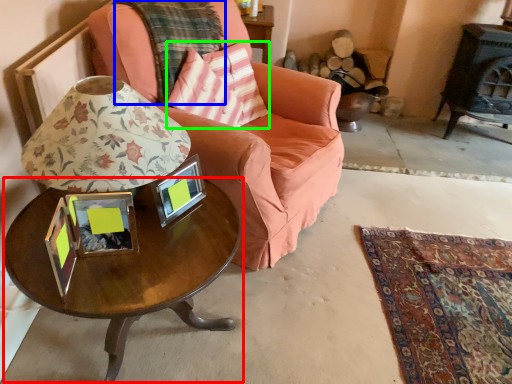
Question: Which object is positioned farthest from coffee table (highlighted by a red box)? Select from plaid (highlighted by a blue box) and throw pillow (highlighted by a green box).

Choices:
 (A) plaid
 (B) throw pillow

Answer: (A)